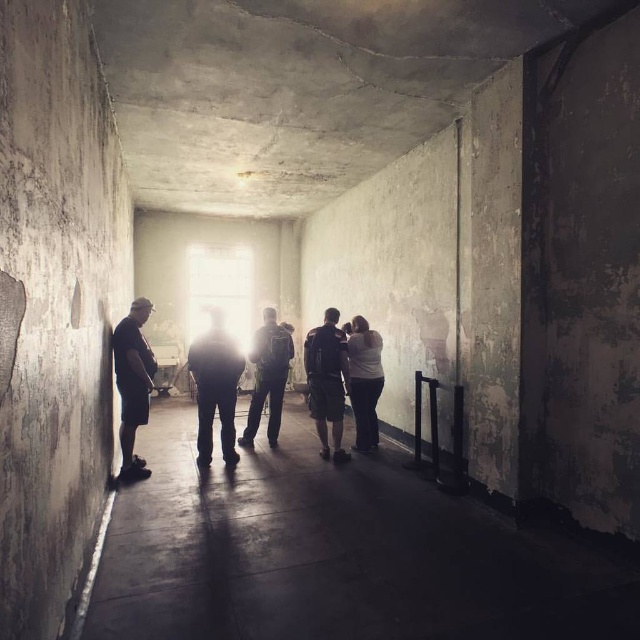
You are a person who is 5 feet tall. You want to walk from where you are to the entrance at the far end. There are two items in your path at the center of the corridor, a dark gray fabric pants at center and a white matte shirt at center. Can you step between them without bending down?

The distance between the dark gray fabric pants at center and the white matte shirt at center is 5.66 feet, which is more than enough space for a 5 feet tall person to walk through without needing to bend down.